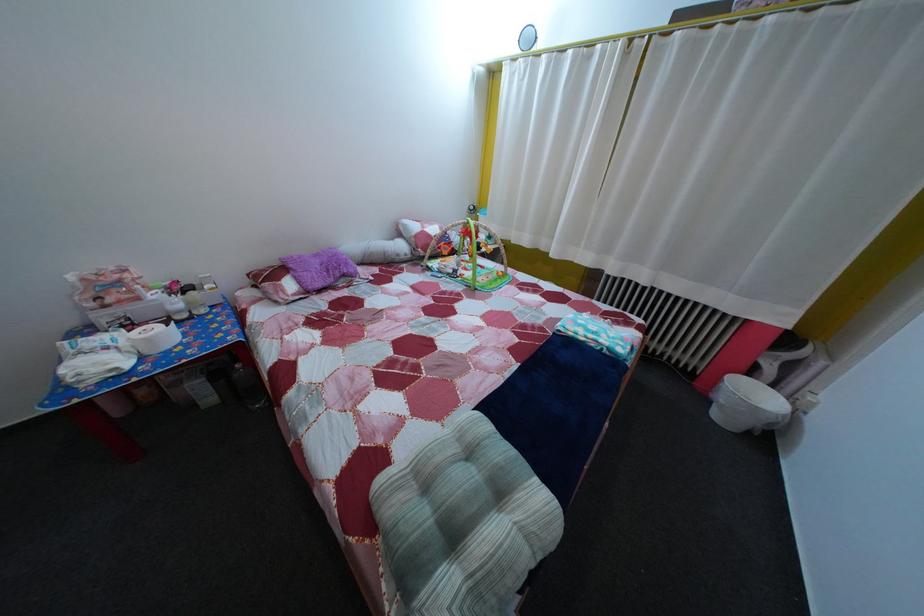
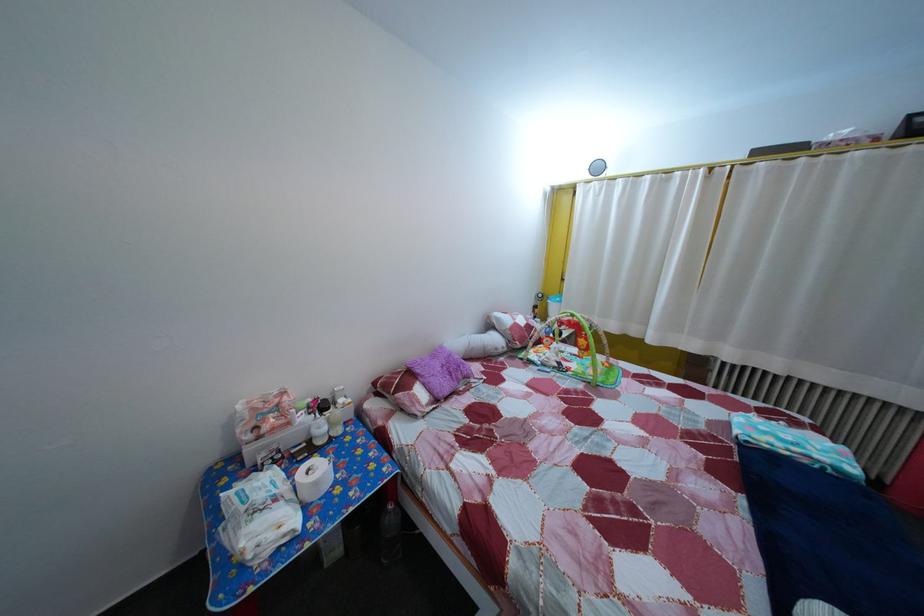
The point at [165,304] is marked in the first image. Where is the corresponding point in the second image?

(311, 427)